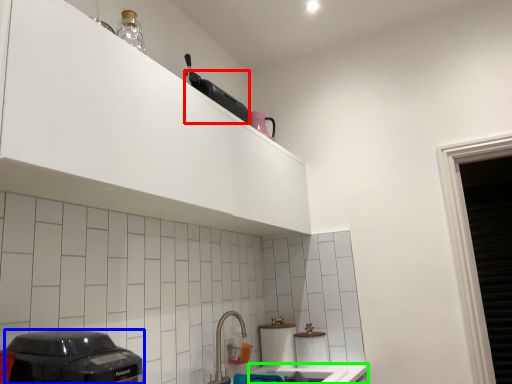
Question: Based on their relative distances, which object is farther from appliance (highlighted by a red box)? Choose from home appliance (highlighted by a blue box) and counter top (highlighted by a green box).

Choices:
 (A) home appliance
 (B) counter top

Answer: (B)